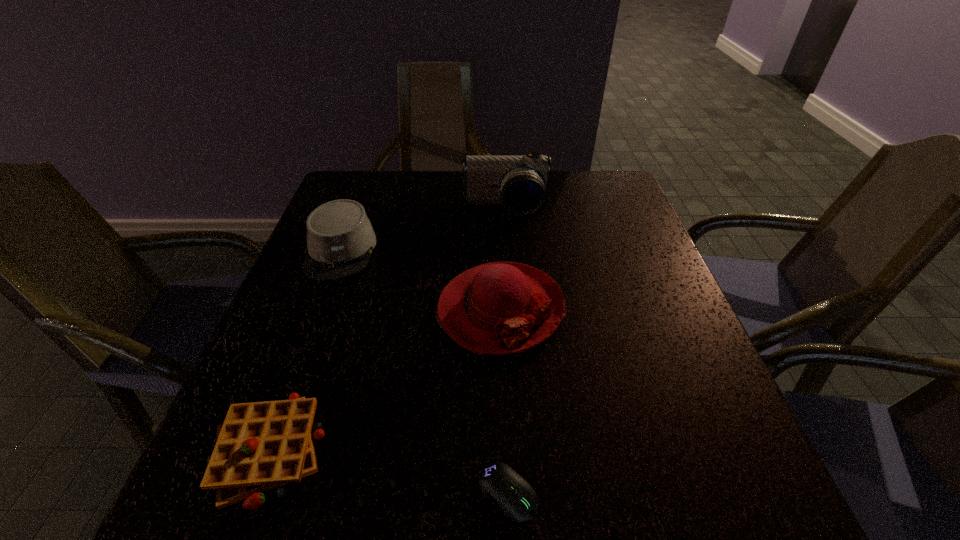
At what (x,y) coordinates should I click in order to perform the action: click on free space between the camcorder and the right hat. Please return your answer as a coordinate pair (x, y). Image resolution: width=960 pixels, height=540 pixels. Looking at the image, I should click on (503, 259).

Image resolution: width=960 pixels, height=540 pixels. Find the location of `vacant space that is in between the left hat and the fourth shortest object`. vacant space that is in between the left hat and the fourth shortest object is located at coordinates (420, 280).

The width and height of the screenshot is (960, 540). In order to click on vacant space that's between the waffle and the right hat in this screenshot , I will do `click(384, 379)`.

This screenshot has width=960, height=540. What are the coordinates of `vacant space that's between the fourth shortest object and the third shortest object` in the screenshot? It's located at (420, 280).

The width and height of the screenshot is (960, 540). I want to click on object that can be found as the third closest to the farthest object, so click(260, 446).

The height and width of the screenshot is (540, 960). Identify the location of object that is the fourth closest to the waffle. (521, 183).

What are the coordinates of `blank space that satisfies the following two spatial constraints: 1. on the front-facing side of the shorter hat; 2. on the right side of the shortest object` in the screenshot? It's located at (251, 493).